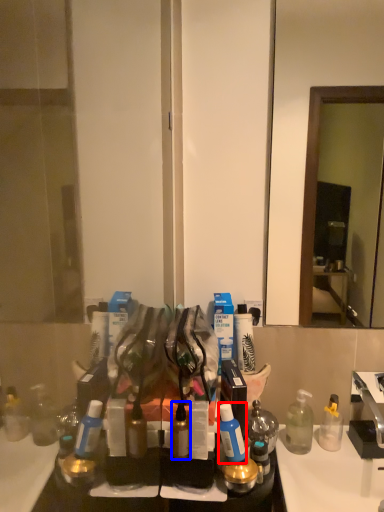
Question: Which object appears closest to the camera in this image, toiletry (highlighted by a red box) or toiletry (highlighted by a blue box)?

Choices:
 (A) toiletry
 (B) toiletry

Answer: (A)